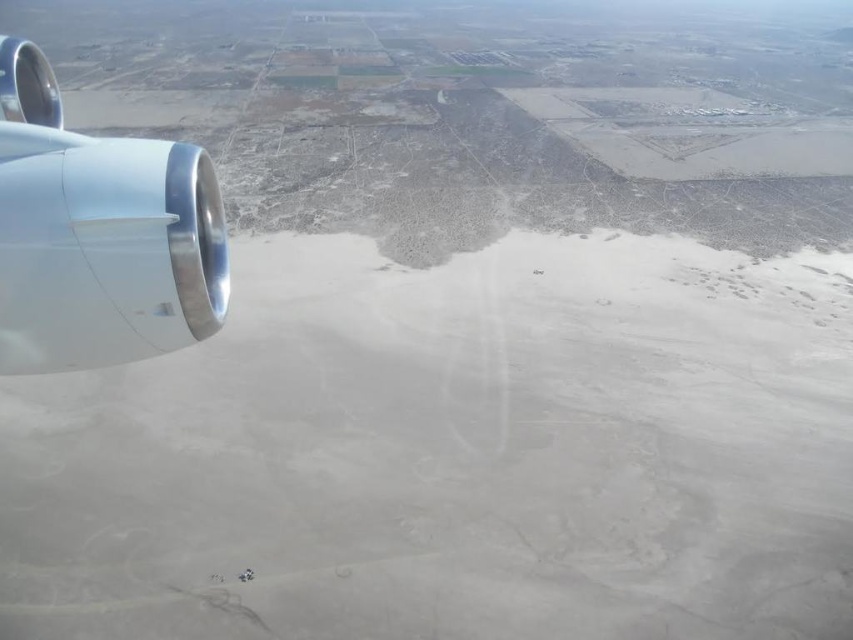
Question: Which is farther from the metallic silver engine at left?

Choices:
 (A) white sand at left
 (B) polished chrome airplane engine at left

Answer: (A)

Question: Does white sand at left have a smaller size compared to metallic silver engine at left?

Choices:
 (A) yes
 (B) no

Answer: (B)

Question: Does white sand at left appear over polished chrome airplane engine at left?

Choices:
 (A) yes
 (B) no

Answer: (B)

Question: Which point is farther to the camera?

Choices:
 (A) (190, 186)
 (B) (12, 54)
 (C) (776, 614)

Answer: (C)

Question: Estimate the real-world distances between objects in this image. Which object is closer to the metallic silver engine at left?

Choices:
 (A) polished chrome airplane engine at left
 (B) white sand at left

Answer: (A)

Question: Can you confirm if metallic silver engine at left is thinner than polished chrome airplane engine at left?

Choices:
 (A) no
 (B) yes

Answer: (A)